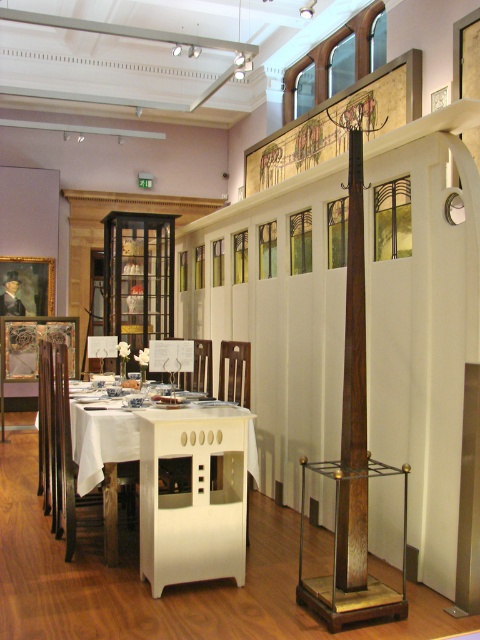
Question: Observing the image, what is the correct spatial positioning of mahogany wood chair at center in reference to white glossy table at center?

Choices:
 (A) right
 (B) left

Answer: (B)

Question: Which object is closer to the camera taking this photo?

Choices:
 (A) wooden chair at center
 (B) matte white wood chair at center
 (C) mahogany wood chair at center
 (D) white glossy table at center

Answer: (D)

Question: Considering the relative positions of white glossy table at center and wooden chair at center in the image provided, where is white glossy table at center located with respect to wooden chair at center?

Choices:
 (A) above
 (B) below

Answer: (B)

Question: Can you confirm if mahogany wood chair at center is wider than white glossy table at center?

Choices:
 (A) no
 (B) yes

Answer: (B)

Question: Estimate the real-world distances between objects in this image. Which object is closer to the white glossy table at center?

Choices:
 (A) matte white wood chair at center
 (B) wooden chair at center
 (C) brown polished wood umbrella stand at center

Answer: (B)

Question: Which is nearer to the wooden chair at center?

Choices:
 (A) brown polished wood umbrella stand at center
 (B) white glossy table at center

Answer: (B)